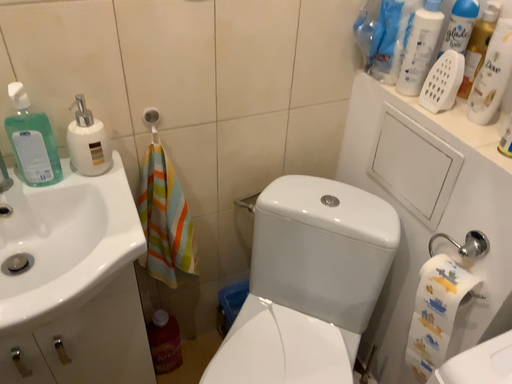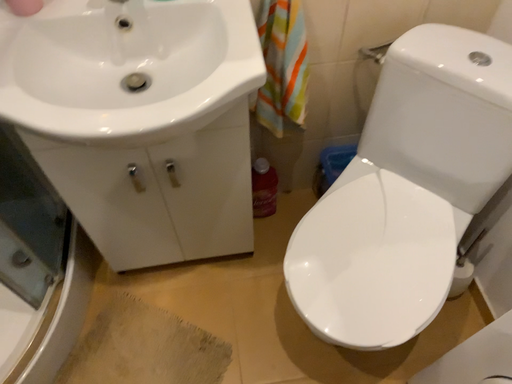
Question: How did the camera likely rotate when shooting the video?

Choices:
 (A) rotated right
 (B) rotated left

Answer: (B)